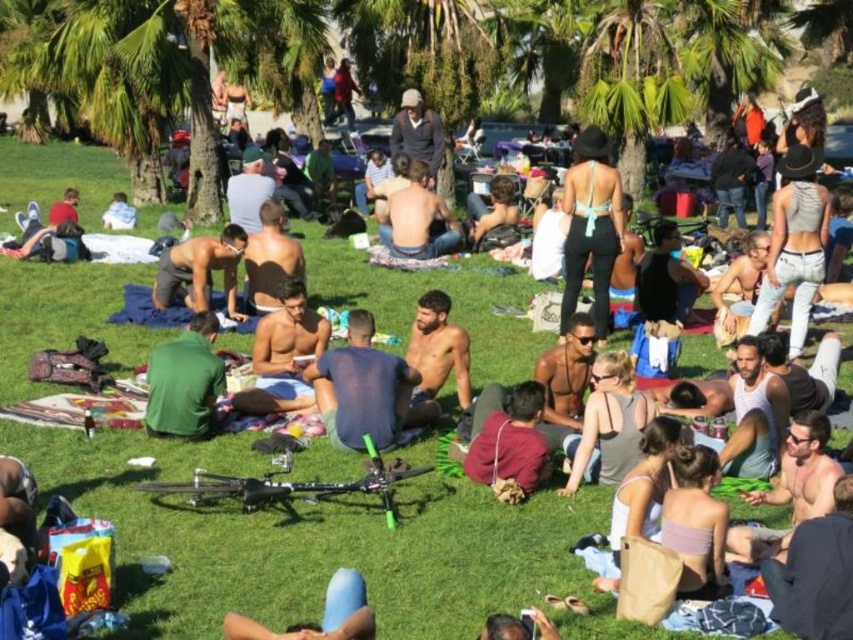
Question: From the image, what is the correct spatial relationship of green matte shirt at center in relation to black fabric top at center?

Choices:
 (A) above
 (B) below

Answer: (B)

Question: Which object is positioned closest to the green matte shirt at center?

Choices:
 (A) white fabric at center-left
 (B) shiny metallic shirt at center
 (C) smooth skin at center
 (D) maroon fabric bag at center

Answer: (C)

Question: Can you confirm if matte blue tank top at center is thinner than shiny metallic shirt at center?

Choices:
 (A) no
 (B) yes

Answer: (B)

Question: Is matte blue tank top at center smaller than black fabric top at center?

Choices:
 (A) yes
 (B) no

Answer: (B)

Question: Among these points, which one is nearest to the camera?

Choices:
 (A) (254, 248)
 (B) (297, 355)

Answer: (B)

Question: Which is nearer to the green matte shirt at center?

Choices:
 (A) blue cotton shirt at center
 (B) black fabric top at center
 (C) shiny skin at center

Answer: (A)